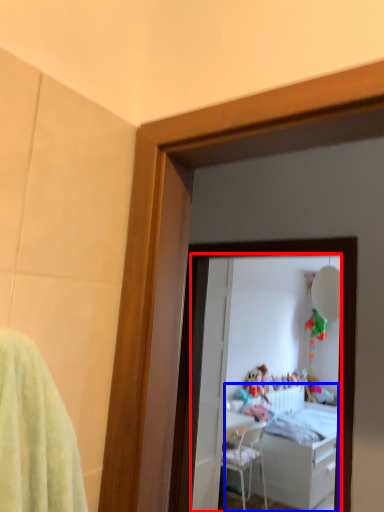
Question: Which object appears closest to the camera in this image, mirror (highlighted by a red box) or bed (highlighted by a blue box)?

Choices:
 (A) mirror
 (B) bed

Answer: (A)